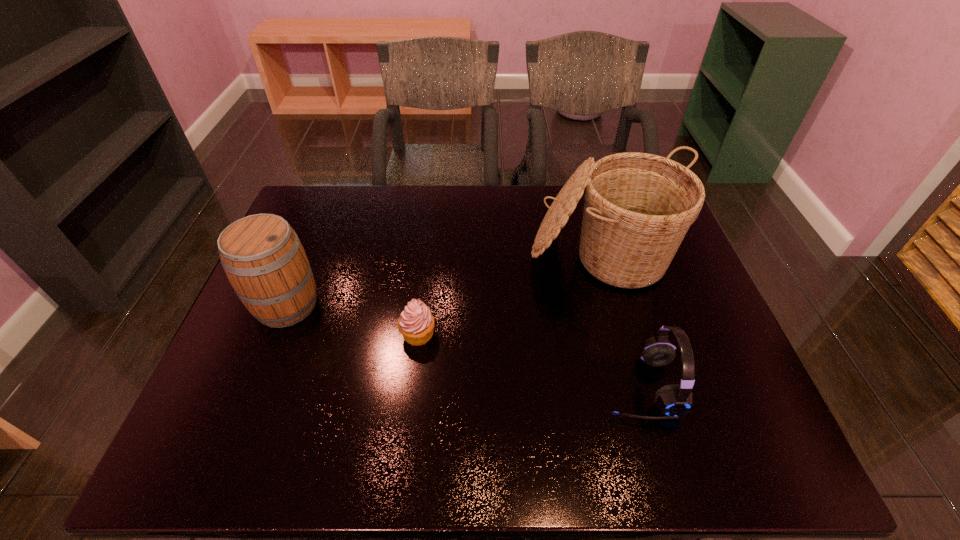
Locate an element on the screen. vacant space situated on the ear cushions of the nearest object is located at coordinates (456, 386).

Where is `vacant region located on the ear cushions of the nearest object`? The width and height of the screenshot is (960, 540). vacant region located on the ear cushions of the nearest object is located at coordinates pyautogui.click(x=487, y=386).

What are the coordinates of `free space located on the left of the third object from right to left` in the screenshot? It's located at tap(355, 334).

The width and height of the screenshot is (960, 540). I want to click on object located in the far edge section of the desktop, so click(x=638, y=207).

The width and height of the screenshot is (960, 540). What are the coordinates of `object situated at the left edge` in the screenshot? It's located at (262, 256).

This screenshot has width=960, height=540. In order to click on basket present at the right edge in this screenshot , I will do `click(638, 207)`.

Locate an element on the screen. This screenshot has height=540, width=960. headset that is at the right edge is located at coordinates (674, 400).

Where is `object that is at the far right corner`? Image resolution: width=960 pixels, height=540 pixels. object that is at the far right corner is located at coordinates (638, 207).

Where is `vacant space at the far edge`? The width and height of the screenshot is (960, 540). vacant space at the far edge is located at coordinates (395, 199).

I want to click on vacant area at the near edge, so click(x=611, y=433).